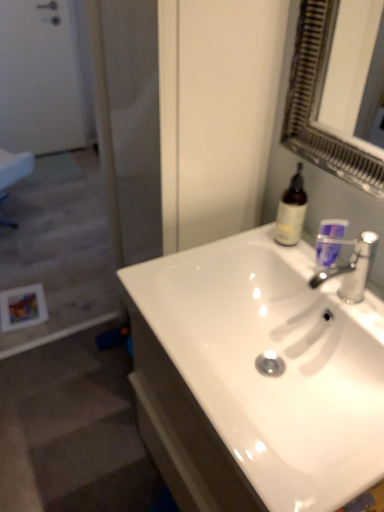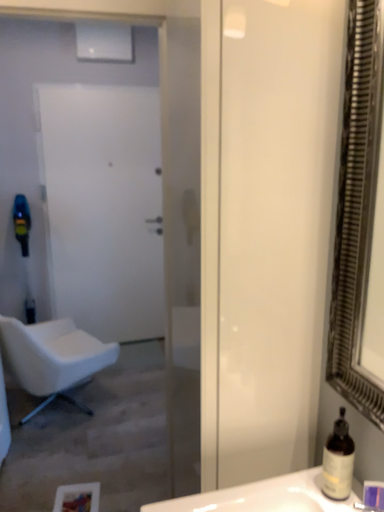
Question: How did the camera likely rotate when shooting the video?

Choices:
 (A) rotated upward
 (B) rotated downward

Answer: (A)